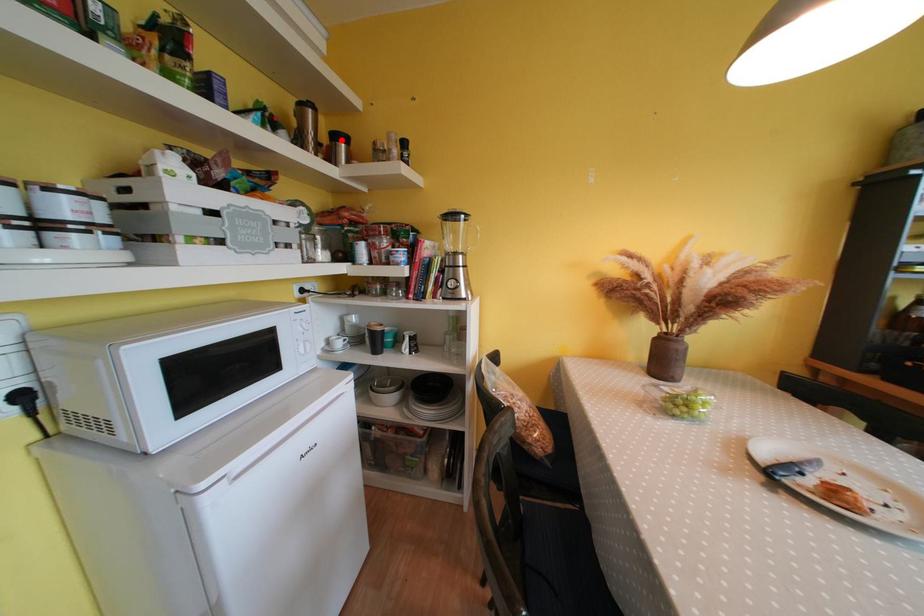
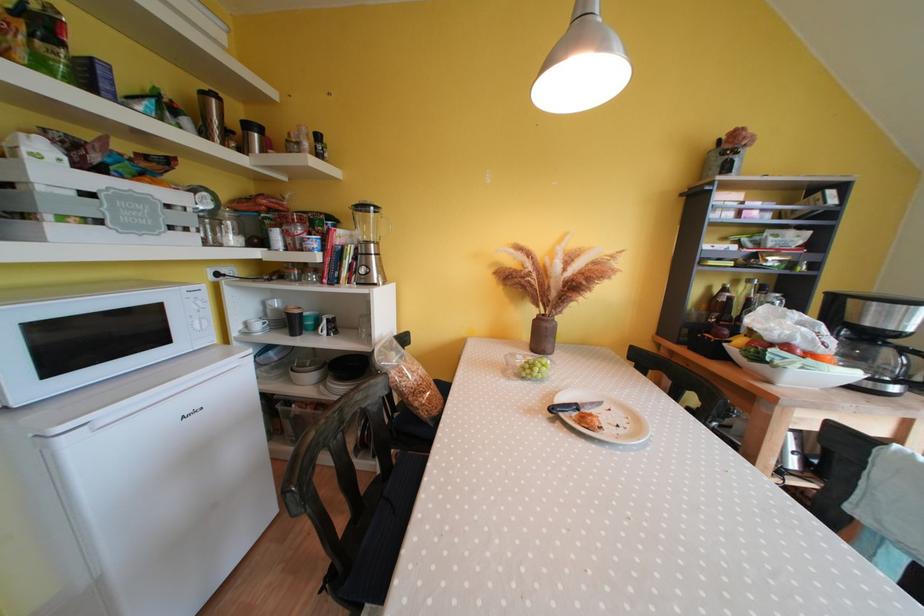
In the second image, find the point that corresponds to the highlighted location in the first image.

(252, 130)